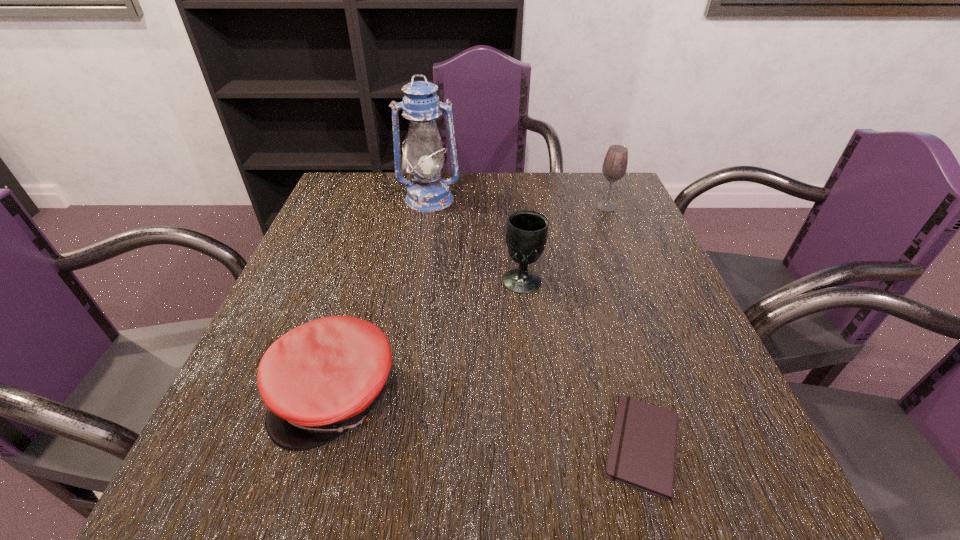
The width and height of the screenshot is (960, 540). Find the location of `the tallest object`. the tallest object is located at coordinates (428, 192).

In order to click on glass drink container in this screenshot , I will do `click(614, 167)`.

You are a GUI agent. You are given a task and a screenshot of the screen. Output one action in this format:
    pyautogui.click(x=<x>, y=<y>)
    Task: Click on the third farthest object
    
    Given the screenshot: What is the action you would take?
    pyautogui.click(x=526, y=235)

Where is `the third object from left to right`? Image resolution: width=960 pixels, height=540 pixels. the third object from left to right is located at coordinates (526, 235).

Where is `the second shortest object`? This screenshot has height=540, width=960. the second shortest object is located at coordinates (322, 378).

Where is `checkbook`? checkbook is located at coordinates (642, 454).

This screenshot has height=540, width=960. Find the location of `vacant point located 0.300m on the front-facing side of the lantern`. vacant point located 0.300m on the front-facing side of the lantern is located at coordinates (415, 289).

Find the location of `vacant space situated 0.290m on the left of the glass drink container`. vacant space situated 0.290m on the left of the glass drink container is located at coordinates (487, 207).

Identify the location of vacant region located 0.160m on the left of the chalice. pyautogui.click(x=429, y=280).

The height and width of the screenshot is (540, 960). In order to click on free region located at the front of the cap where the visor is located in this screenshot , I will do `click(304, 508)`.